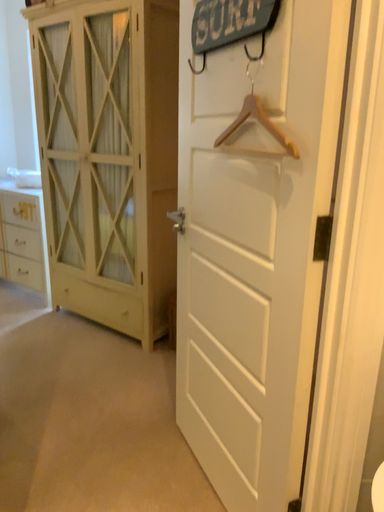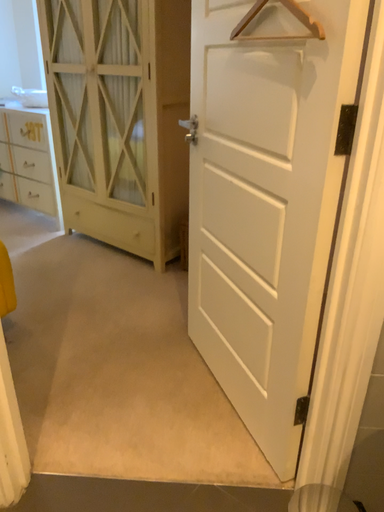
Question: How did the camera likely rotate when shooting the video?

Choices:
 (A) rotated upward
 (B) rotated downward

Answer: (B)